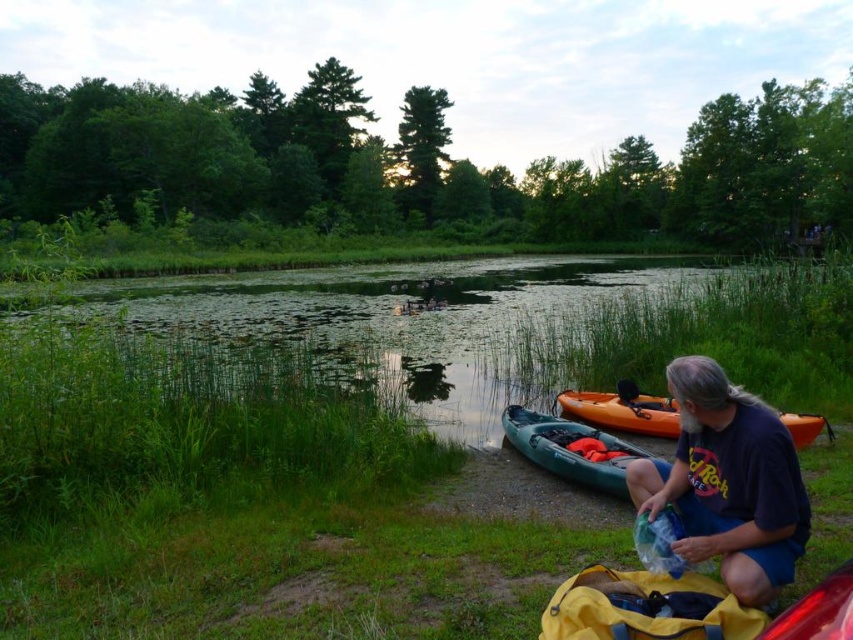
Which is in front, point (717, 522) or point (614, 440)?

Positioned in front is point (717, 522).

Is point (728, 573) positioned in front of point (579, 484)?

Yes, it is.

Locate an element on the screen. This screenshot has width=853, height=640. dark blue t-shirt at lower right is located at coordinates (728, 483).

Consider the image. Is teal plastic canoe at lower center taller than orange plastic canoe at lower right?

Yes.

Who is taller, teal plastic canoe at lower center or orange plastic canoe at lower right?

teal plastic canoe at lower center

Identify the location of teal plastic canoe at lower center. (570, 449).

The width and height of the screenshot is (853, 640). Identify the location of teal plastic canoe at lower center. (570, 449).

Between green grassy water at center and orange plastic canoe at lower right, which one appears on the right side from the viewer's perspective?

Positioned to the right is orange plastic canoe at lower right.

Can you confirm if green grassy water at center is wider than orange plastic canoe at lower right?

Yes.

Which is in front, point (27, 310) or point (608, 392)?

Point (27, 310) is more forward.

Find the location of `green grassy water at center`. green grassy water at center is located at coordinates (393, 321).